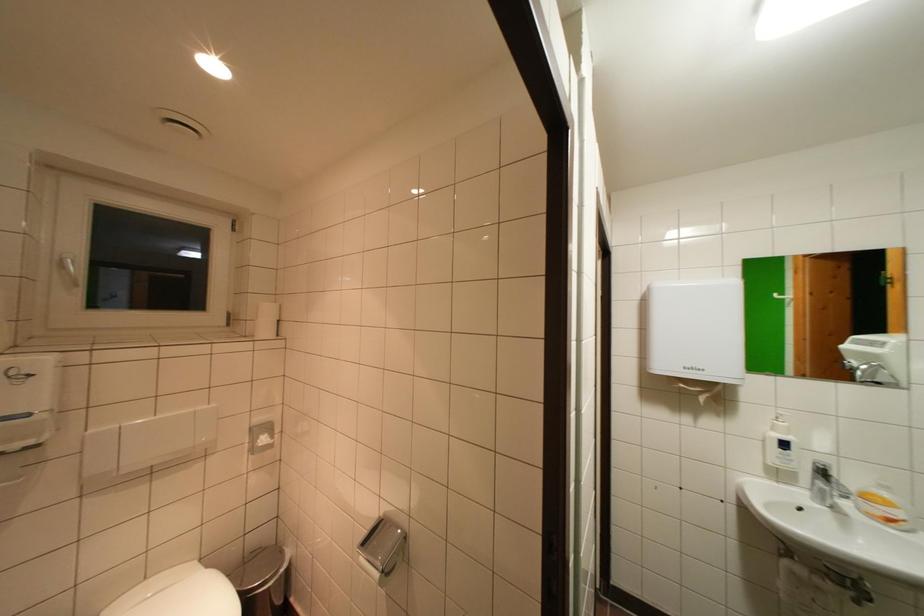
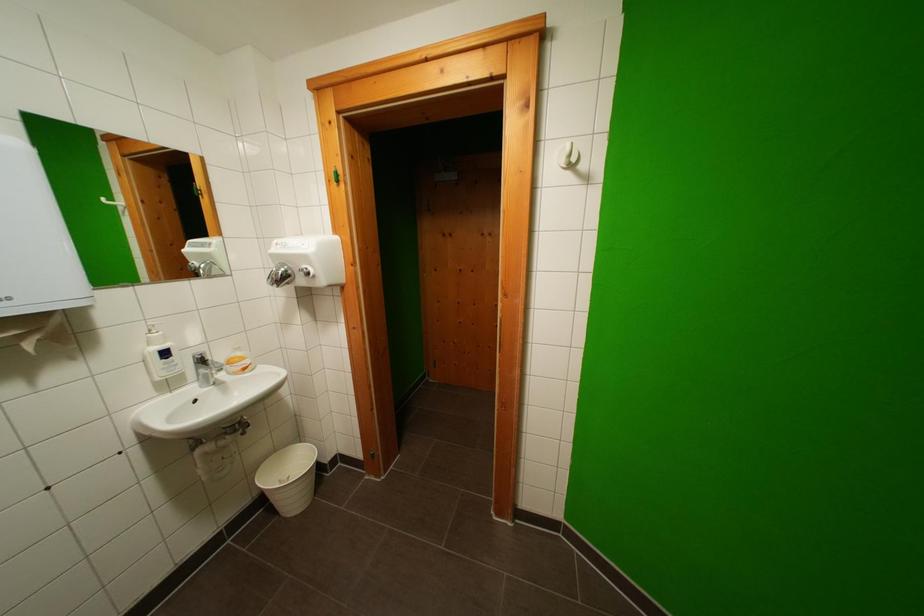
The images are taken continuously from a first-person perspective. In which direction is your viewpoint rotating?

The camera's rotation is toward right-down.